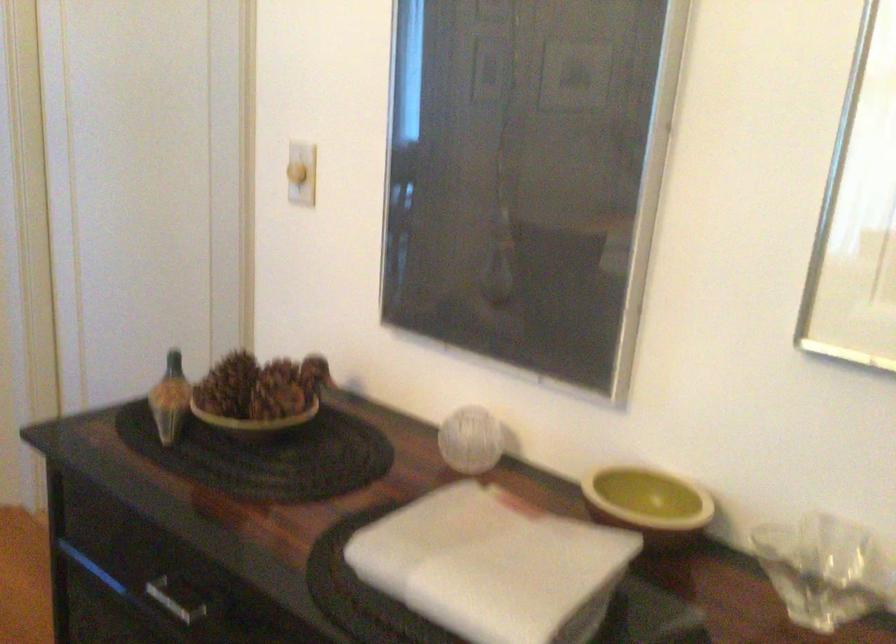
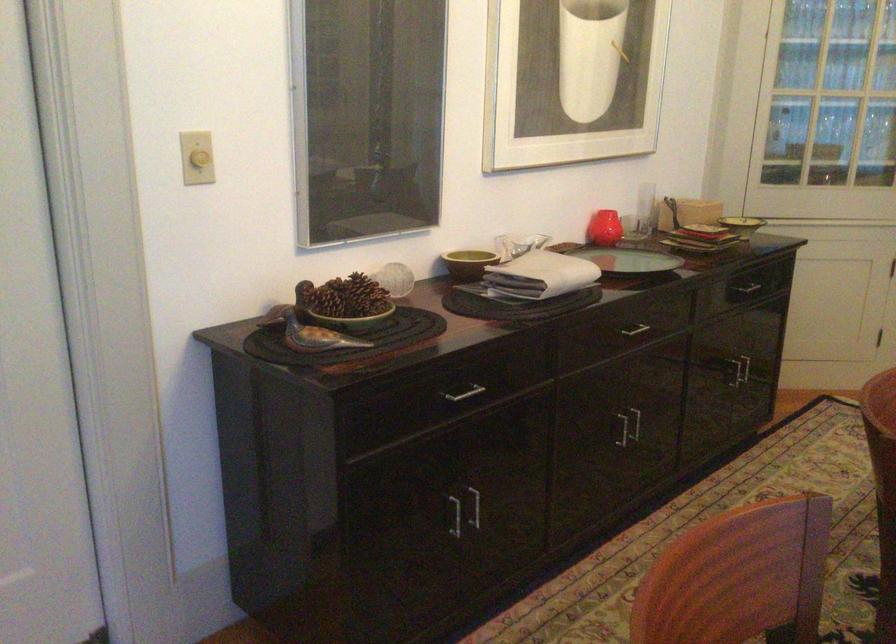
Locate, in the second image, the point that corresponds to pixel 256 187 in the first image.

(200, 158)